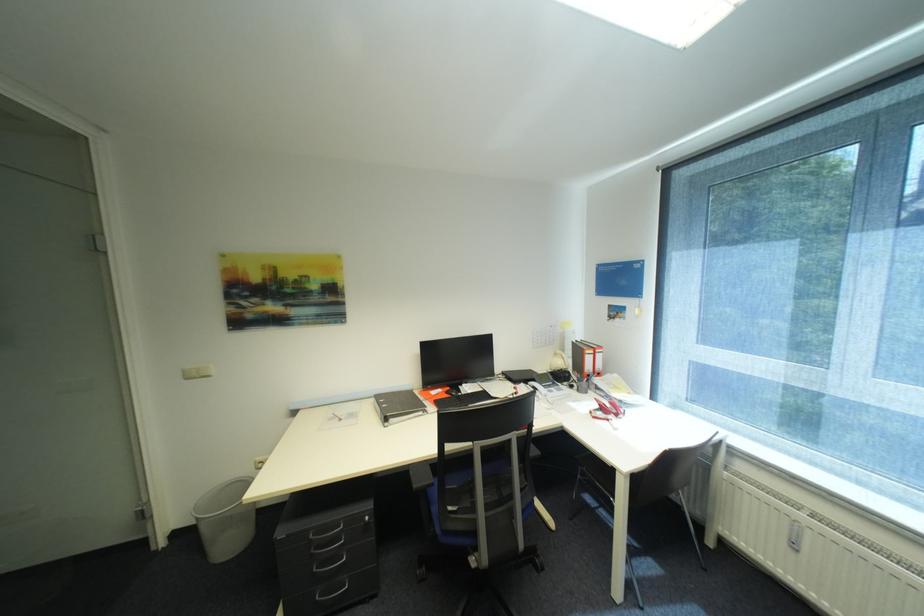
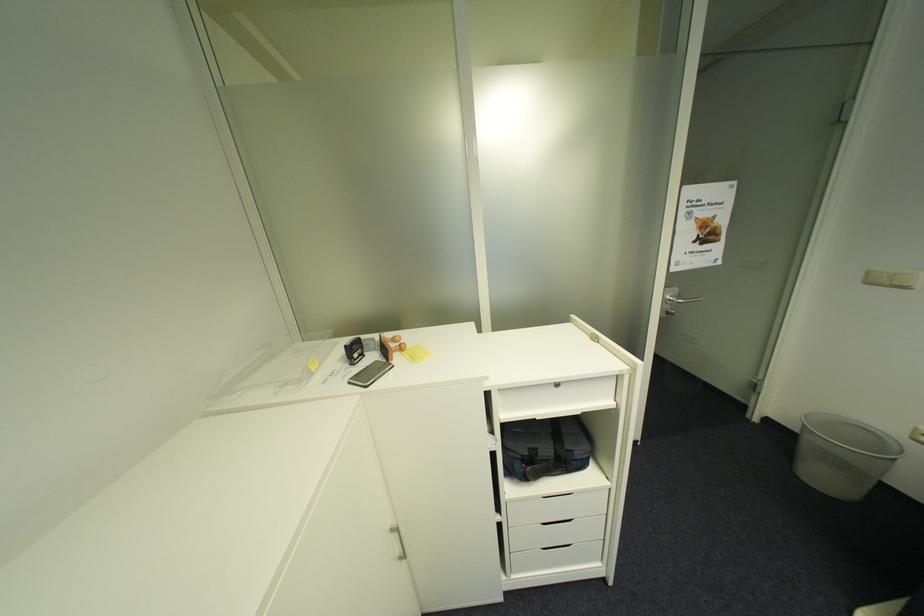
Find the pixel in the second image that matches point 195,379 in the first image.

(876, 284)